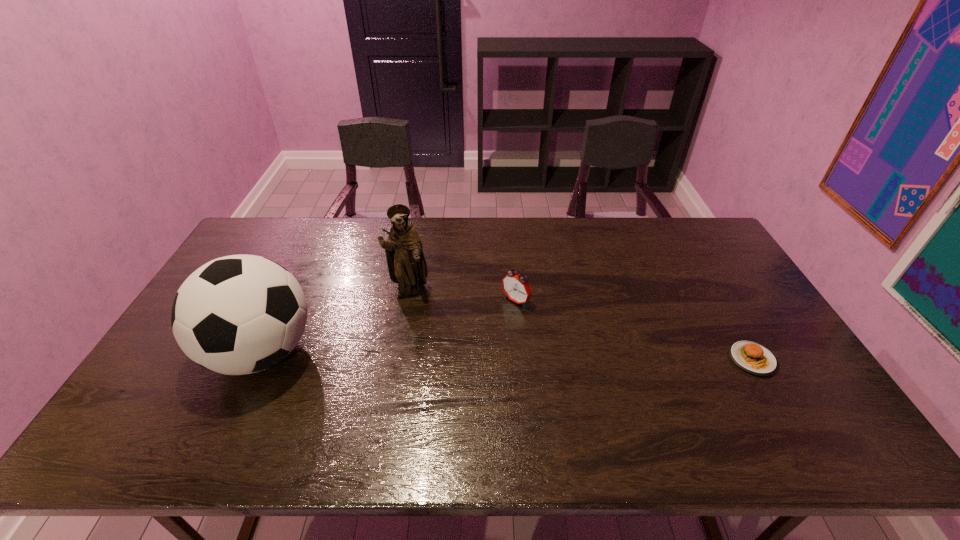
Find the location of a particular element. vacant space situated 0.120m on the clock face of the alarm clock is located at coordinates (481, 331).

Locate an element on the screen. vacant position located 0.200m on the front-facing side of the second object from left to right is located at coordinates (445, 343).

Locate an element on the screen. The width and height of the screenshot is (960, 540). free space located 0.210m on the front-facing side of the second object from left to right is located at coordinates (446, 346).

I want to click on vacant area situated 0.290m on the front-facing side of the second object from left to right, so click(460, 366).

I want to click on object that is at the near edge, so click(240, 314).

Locate an element on the screen. The height and width of the screenshot is (540, 960). object positioned at the left edge is located at coordinates (240, 314).

Where is `object that is at the right edge`? object that is at the right edge is located at coordinates (751, 357).

The width and height of the screenshot is (960, 540). What are the coordinates of `object at the near left corner` in the screenshot? It's located at (240, 314).

The height and width of the screenshot is (540, 960). I want to click on vacant space at the far edge, so click(306, 227).

Identify the location of vacant space at the near edge of the desktop. This screenshot has width=960, height=540. (744, 413).